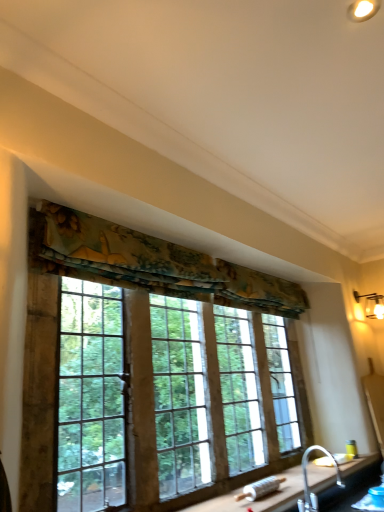
Question: From the image's perspective, is silver metallic faucet at lower right below matte white wall sconce at upper right?

Choices:
 (A) yes
 (B) no

Answer: (A)

Question: Is silver metallic faucet at lower right positioned with its back to matte white wall sconce at upper right?

Choices:
 (A) no
 (B) yes

Answer: (A)

Question: From a real-world perspective, is silver metallic faucet at lower right under matte white wall sconce at upper right?

Choices:
 (A) yes
 (B) no

Answer: (A)

Question: Could you tell me if silver metallic faucet at lower right is turned towards matte white wall sconce at upper right?

Choices:
 (A) no
 (B) yes

Answer: (A)

Question: Are silver metallic faucet at lower right and matte white wall sconce at upper right making contact?

Choices:
 (A) no
 (B) yes

Answer: (A)

Question: Is point (122, 250) positioned closer to the camera than point (365, 309)?

Choices:
 (A) closer
 (B) farther

Answer: (A)

Question: From a real-world perspective, is textured floral fabric at upper center positioned above or below matte white wall sconce at upper right?

Choices:
 (A) below
 (B) above

Answer: (B)

Question: In terms of width, does textured floral fabric at upper center look wider or thinner when compared to matte white wall sconce at upper right?

Choices:
 (A) wide
 (B) thin

Answer: (B)

Question: Looking at the image, does textured floral fabric at upper center seem bigger or smaller compared to matte white wall sconce at upper right?

Choices:
 (A) big
 (B) small

Answer: (A)

Question: In the image, is textured fabric valance at upper center positioned in front of or behind silver metallic faucet at lower right?

Choices:
 (A) front
 (B) behind

Answer: (A)

Question: Do you think textured fabric valance at upper center is within silver metallic faucet at lower right, or outside of it?

Choices:
 (A) outside
 (B) inside

Answer: (A)

Question: Is textured fabric valance at upper center to the left or to the right of silver metallic faucet at lower right in the image?

Choices:
 (A) left
 (B) right

Answer: (A)

Question: Is textured fabric valance at upper center taller or shorter than silver metallic faucet at lower right?

Choices:
 (A) tall
 (B) short

Answer: (A)

Question: From their relative heights in the image, would you say silver metallic faucet at lower right is taller or shorter than matte white wall sconce at upper right?

Choices:
 (A) tall
 (B) short

Answer: (A)

Question: From the image's perspective, is silver metallic faucet at lower right positioned above or below matte white wall sconce at upper right?

Choices:
 (A) below
 (B) above

Answer: (A)